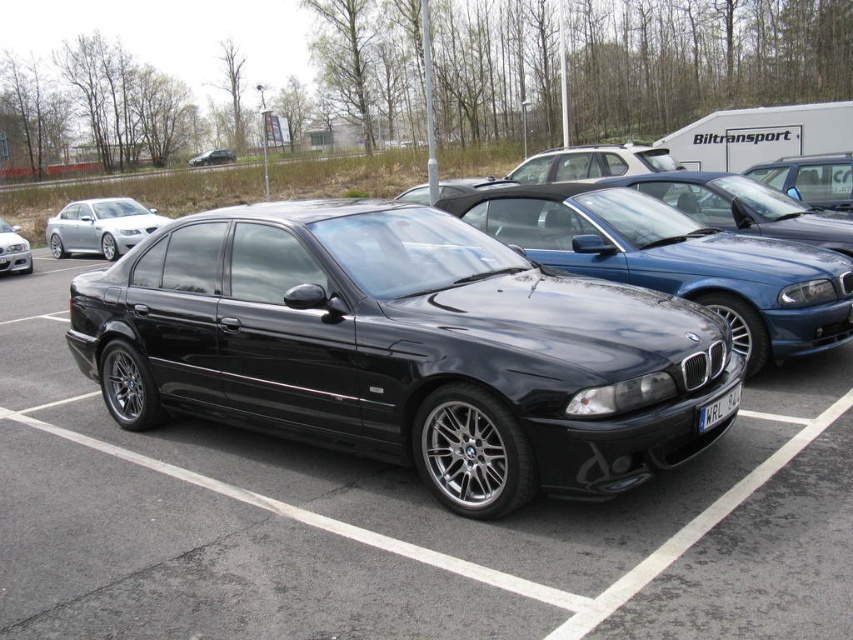
Find the location of `glossy black sedan at center`. glossy black sedan at center is located at coordinates (403, 348).

How far apart are glossy black sedan at center and matte black sedan at center?

glossy black sedan at center is 203.58 feet away from matte black sedan at center.

Where is `glossy black sedan at center`? glossy black sedan at center is located at coordinates (403, 348).

In the scene shown: Can you confirm if glossy black sedan at center is shorter than matte black sedan at left?

No, glossy black sedan at center is not shorter than matte black sedan at left.

Which is behind, point (450, 269) or point (4, 230)?

The point (4, 230) is behind.

Where is `glossy black sedan at center`? The width and height of the screenshot is (853, 640). glossy black sedan at center is located at coordinates (403, 348).

Does glossy black sedan at center come behind satin silver sedan at left?

No, glossy black sedan at center is closer to the viewer.

Between glossy black sedan at center and satin silver sedan at left, which one appears on the right side from the viewer's perspective?

glossy black sedan at center is more to the right.

Who is more forward, (292, 278) or (57, 244)?

Point (292, 278)

Identify the location of glossy black sedan at center. (403, 348).